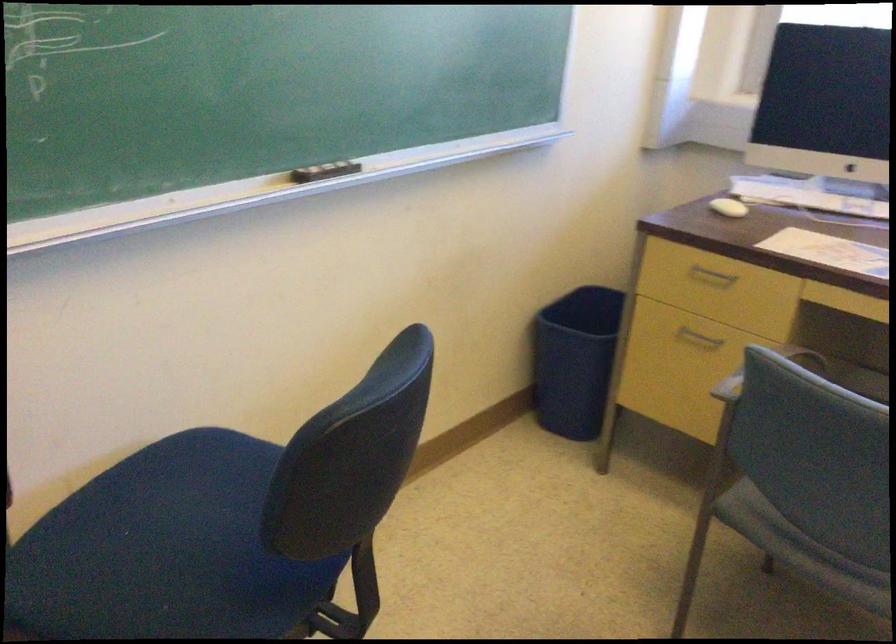
Identify the location of grey chair armrest. (764, 371).